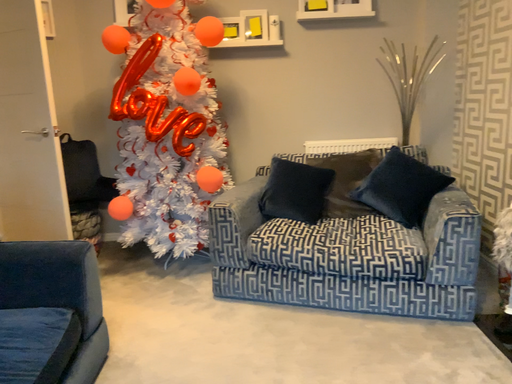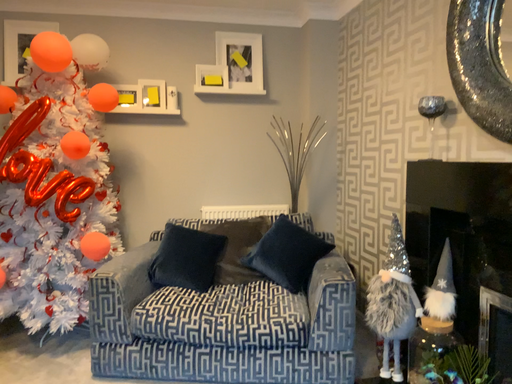
Question: Which way did the camera rotate in the video?

Choices:
 (A) rotated downward
 (B) rotated upward

Answer: (B)